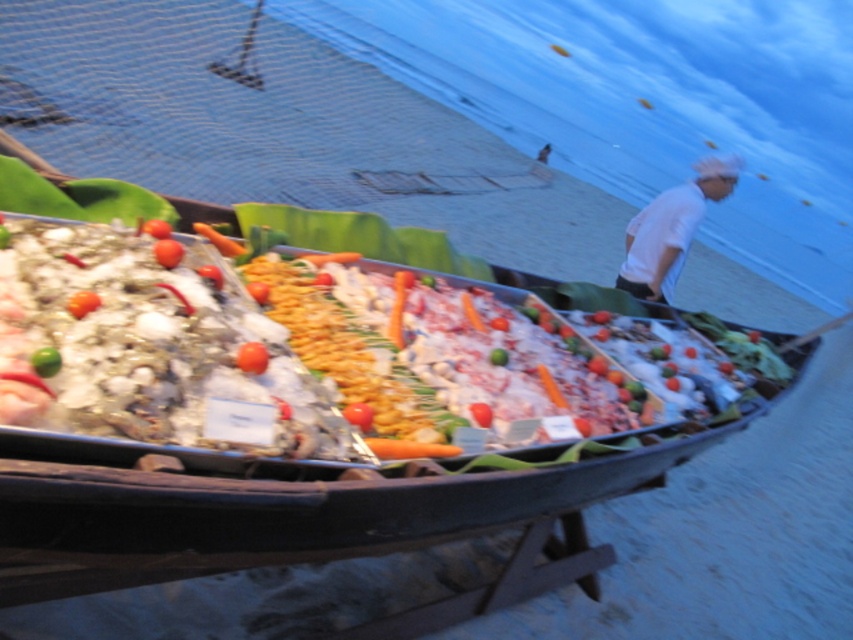
Does red smooth tomato at center have a lesser width compared to green matte carrot at center?

No, red smooth tomato at center is not thinner than green matte carrot at center.

The width and height of the screenshot is (853, 640). Describe the element at coordinates (167, 252) in the screenshot. I see `red smooth tomato at center` at that location.

Who is more distant from viewer, (x=173, y=262) or (x=164, y=225)?

The point (x=164, y=225) is behind.

You are a GUI agent. You are given a task and a screenshot of the screen. Output one action in this format:
    pyautogui.click(x=<x>, y=<y>)
    Task: Click on the red smooth tomato at center
    
    Given the screenshot: What is the action you would take?
    pyautogui.click(x=167, y=252)

Can you confirm if white cloth at upper right is positioned to the left of orange smooth carrot at center?

In fact, white cloth at upper right is to the right of orange smooth carrot at center.

Who is more forward, (654, 289) or (349, 404)?

Point (349, 404) is more forward.

The width and height of the screenshot is (853, 640). In order to click on white cloth at upper right in this screenshot , I will do `click(671, 228)`.

Is green matte lime at center above carrot at center?

Actually, green matte lime at center is below carrot at center.

Can you confirm if green matte lime at center is wider than carrot at center?

No.

Locate an element on the screen. The image size is (853, 640). green matte lime at center is located at coordinates (45, 362).

Image resolution: width=853 pixels, height=640 pixels. I want to click on green matte lime at center, so click(x=45, y=362).